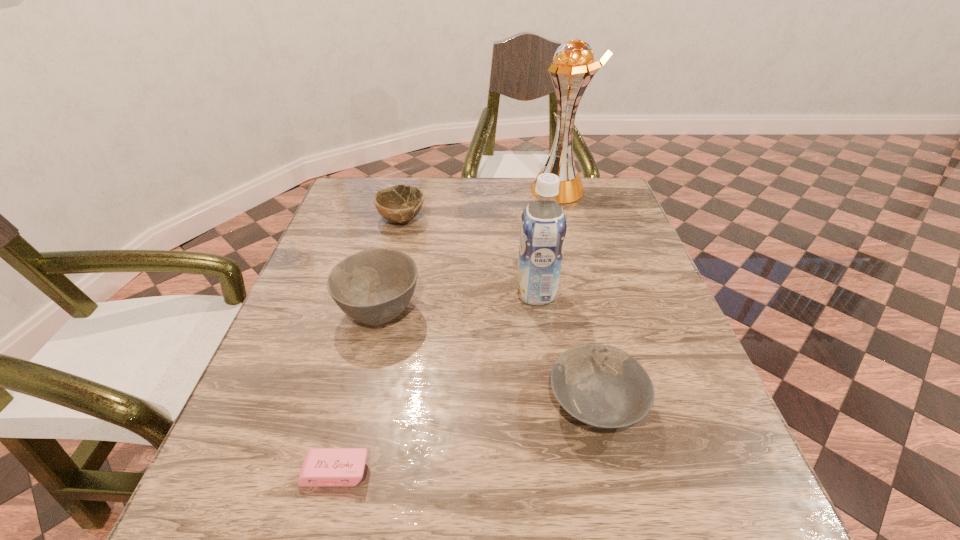
Locate an element on the screen. vacant point located between the fifth farthest object and the second tallest object is located at coordinates (565, 348).

I want to click on free space between the fifth nearest object and the rightmost bowl, so click(498, 311).

Find the location of a particular element. empty location between the farthest object and the rightmost bowl is located at coordinates (577, 296).

The image size is (960, 540). I want to click on the third closest object relative to the second tallest object, so click(400, 203).

Where is `the fifth closest object to the eraser`? the fifth closest object to the eraser is located at coordinates (573, 68).

Where is `the third closest bowl to the fifth shortest object`? This screenshot has width=960, height=540. the third closest bowl to the fifth shortest object is located at coordinates (400, 203).

You are a GUI agent. You are given a task and a screenshot of the screen. Output one action in this format:
    pyautogui.click(x=<x>, y=<y>)
    Task: Click on the bowl that stands as the second closest to the fourth shortest object
    Image resolution: width=960 pixels, height=540 pixels.
    Given the screenshot: What is the action you would take?
    pyautogui.click(x=602, y=386)

Where is `free region that satisfies the following two spatial constraints: 1. on the front side of the farthest bowl; 2. on the right side of the tallest bowl`? free region that satisfies the following two spatial constraints: 1. on the front side of the farthest bowl; 2. on the right side of the tallest bowl is located at coordinates (379, 312).

Locate an element on the screen. free spot that satisfies the following two spatial constraints: 1. on the front side of the fifth nearest object; 2. on the right side of the rightmost bowl is located at coordinates (357, 403).

Where is `vacant area in the image that satisfies the following two spatial constraints: 1. on the front-facing side of the farthest object; 2. on the front side of the nearest bowl`? vacant area in the image that satisfies the following two spatial constraints: 1. on the front-facing side of the farthest object; 2. on the front side of the nearest bowl is located at coordinates (616, 403).